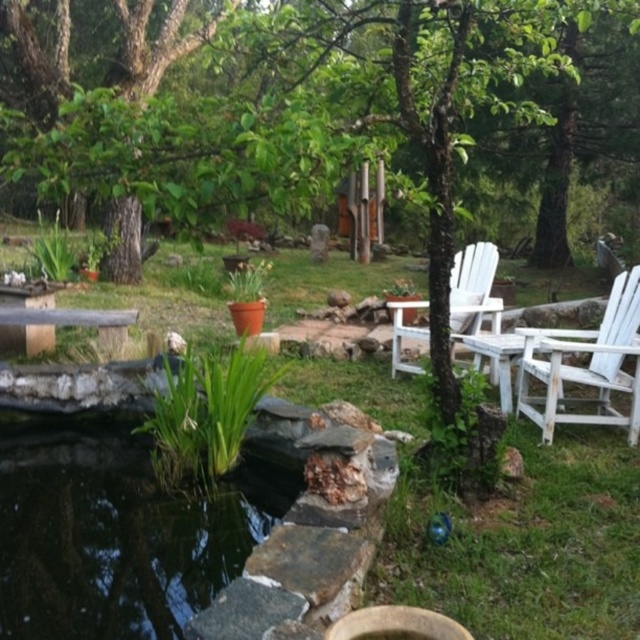
Question: Can you confirm if green leafy plant at center is smaller than white wooden chair at right?

Choices:
 (A) yes
 (B) no

Answer: (B)

Question: Is green leafy plant at center closer to camera compared to white wood chair at center?

Choices:
 (A) yes
 (B) no

Answer: (A)

Question: Which of these objects is positioned closest to the white wooden chair at right?

Choices:
 (A) white wood chair at center
 (B) green leafy plant at center

Answer: (A)

Question: Which of the following is the closest to the observer?

Choices:
 (A) green leafy plant at center
 (B) white wooden chair at right
 (C) white wood chair at center

Answer: (A)

Question: Does green leafy plant at center appear on the right side of white wooden chair at right?

Choices:
 (A) yes
 (B) no

Answer: (B)

Question: Which of these objects is positioned closest to the white wooden chair at right?

Choices:
 (A) green leafy plant at center
 (B) white wood chair at center

Answer: (B)